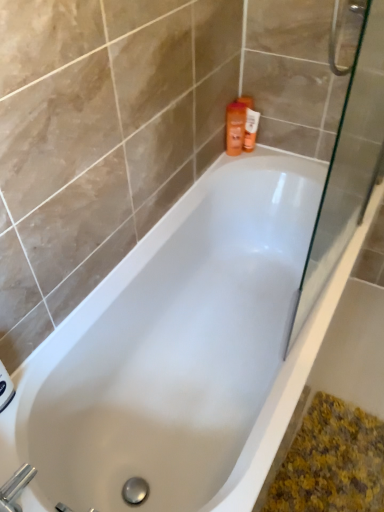
Question: Is transparent glass screen door at right outside orange plastic bottle at upper right?

Choices:
 (A) no
 (B) yes

Answer: (B)

Question: From a real-world perspective, does transparent glass screen door at right sit lower than orange plastic bottle at upper right?

Choices:
 (A) no
 (B) yes

Answer: (A)

Question: Does transparent glass screen door at right have a lesser height compared to orange plastic bottle at upper right?

Choices:
 (A) yes
 (B) no

Answer: (B)

Question: Does transparent glass screen door at right lie behind orange plastic bottle at upper right?

Choices:
 (A) no
 (B) yes

Answer: (A)

Question: Does transparent glass screen door at right have a greater height compared to orange plastic bottle at upper right?

Choices:
 (A) yes
 (B) no

Answer: (A)

Question: From their relative heights in the image, would you say transparent glass screen door at right is taller or shorter than white glossy bathtub at center?

Choices:
 (A) short
 (B) tall

Answer: (B)

Question: From a real-world perspective, is transparent glass screen door at right positioned above or below white glossy bathtub at center?

Choices:
 (A) above
 (B) below

Answer: (A)

Question: Is point pyautogui.click(x=347, y=131) positioned closer to the camera than point pyautogui.click(x=258, y=289)?

Choices:
 (A) farther
 (B) closer

Answer: (B)

Question: Considering the positions of transparent glass screen door at right and white glossy bathtub at center in the image, is transparent glass screen door at right bigger or smaller than white glossy bathtub at center?

Choices:
 (A) big
 (B) small

Answer: (B)

Question: Is transparent glass screen door at right bigger or smaller than silver metallic faucet at lower left?

Choices:
 (A) big
 (B) small

Answer: (A)

Question: Based on their positions, is transparent glass screen door at right located to the left or right of silver metallic faucet at lower left?

Choices:
 (A) left
 (B) right

Answer: (B)

Question: Is transparent glass screen door at right inside the boundaries of silver metallic faucet at lower left, or outside?

Choices:
 (A) outside
 (B) inside

Answer: (A)

Question: Considering the positions of transparent glass screen door at right and silver metallic faucet at lower left in the image, is transparent glass screen door at right taller or shorter than silver metallic faucet at lower left?

Choices:
 (A) short
 (B) tall

Answer: (B)

Question: From the image's perspective, relative to transparent glass screen door at right, is orange plastic bottle at upper right above or below?

Choices:
 (A) below
 (B) above

Answer: (B)

Question: Considering the positions of point (256, 120) and point (302, 279), is point (256, 120) closer or farther from the camera than point (302, 279)?

Choices:
 (A) closer
 (B) farther

Answer: (A)